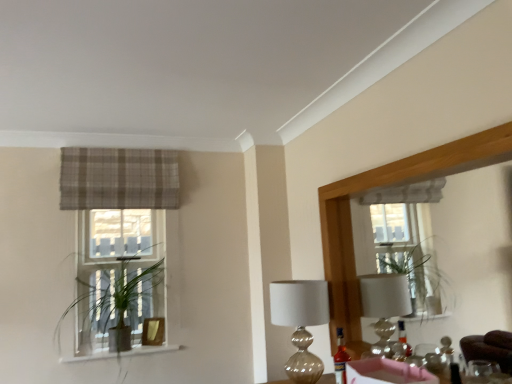
Question: Can you confirm if plaid fabric curtain at upper left is thinner than wooden mirror at upper right?

Choices:
 (A) no
 (B) yes

Answer: (A)

Question: Is plaid fabric curtain at upper left oriented towards wooden mirror at upper right?

Choices:
 (A) yes
 (B) no

Answer: (B)

Question: Is the position of plaid fabric curtain at upper left more distant than that of wooden mirror at upper right?

Choices:
 (A) yes
 (B) no

Answer: (A)

Question: Would you consider plaid fabric curtain at upper left to be distant from wooden mirror at upper right?

Choices:
 (A) yes
 (B) no

Answer: (A)

Question: Is plaid fabric curtain at upper left not inside wooden mirror at upper right?

Choices:
 (A) yes
 (B) no

Answer: (A)

Question: From a real-world perspective, relative to green leafy plant at left, is translucent glass bottle at center vertically above or below?

Choices:
 (A) below
 (B) above

Answer: (A)

Question: Visually, is translucent glass bottle at center positioned to the left or to the right of green leafy plant at left?

Choices:
 (A) left
 (B) right

Answer: (B)

Question: Considering the positions of point (339, 365) and point (123, 339), is point (339, 365) closer or farther from the camera than point (123, 339)?

Choices:
 (A) closer
 (B) farther

Answer: (A)

Question: Considering their positions, is translucent glass bottle at center located in front of or behind green leafy plant at left?

Choices:
 (A) behind
 (B) front

Answer: (B)

Question: Is translucent glass bottle at center situated inside metallic glass table lamp at center or outside?

Choices:
 (A) outside
 (B) inside

Answer: (A)

Question: Considering the positions of translucent glass bottle at center and metallic glass table lamp at center in the image, is translucent glass bottle at center taller or shorter than metallic glass table lamp at center?

Choices:
 (A) short
 (B) tall

Answer: (A)

Question: In the image, is translucent glass bottle at center positioned in front of or behind metallic glass table lamp at center?

Choices:
 (A) behind
 (B) front

Answer: (B)

Question: Does point (347, 354) appear closer or farther from the camera than point (295, 296)?

Choices:
 (A) farther
 (B) closer

Answer: (B)

Question: Is point (297, 321) positioned closer to the camera than point (169, 175)?

Choices:
 (A) closer
 (B) farther

Answer: (A)

Question: From a real-world perspective, is metallic glass table lamp at center positioned above or below plaid fabric curtain at upper left?

Choices:
 (A) below
 (B) above

Answer: (A)